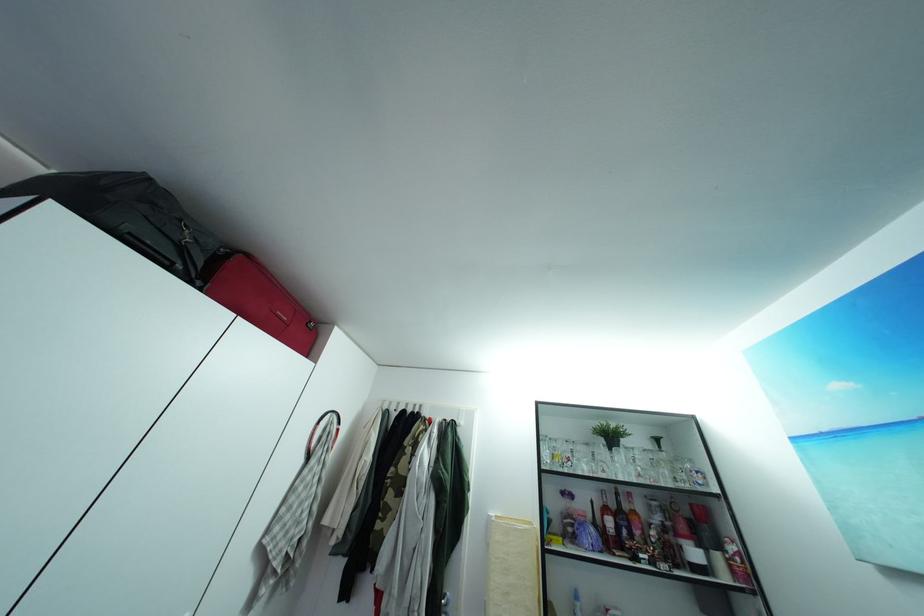
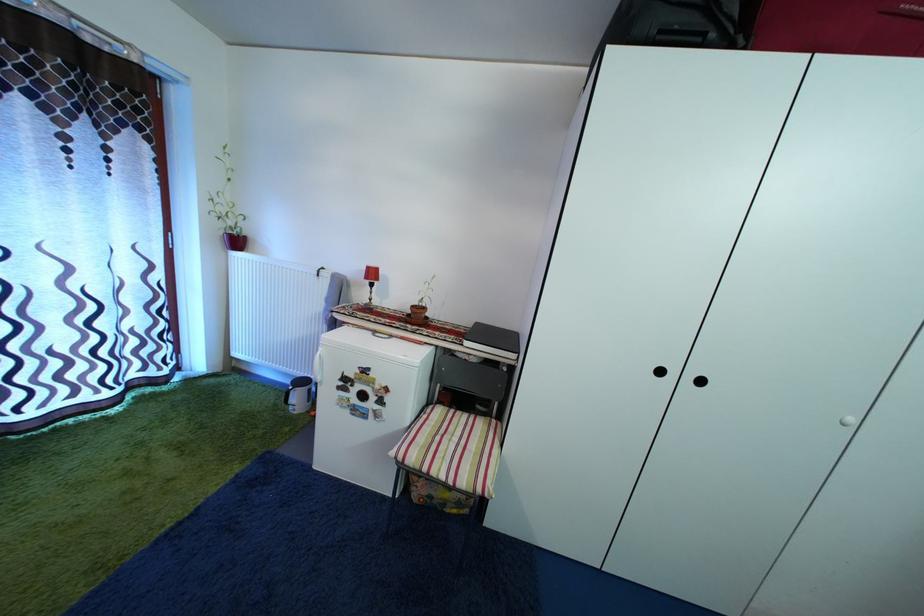
Question: The camera is either moving clockwise (left) or counter-clockwise (right) around the object. The first image is from the beginning of the video and the second image is from the end. Is the camera moving left or right when shooting the video?

Choices:
 (A) Left
 (B) Right

Answer: (B)